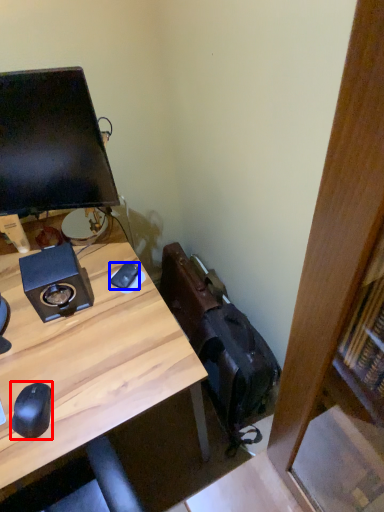
Question: Which point is further to the camera, mouse (highlighted by a red box) or mouse (highlighted by a blue box)?

Choices:
 (A) mouse
 (B) mouse

Answer: (B)